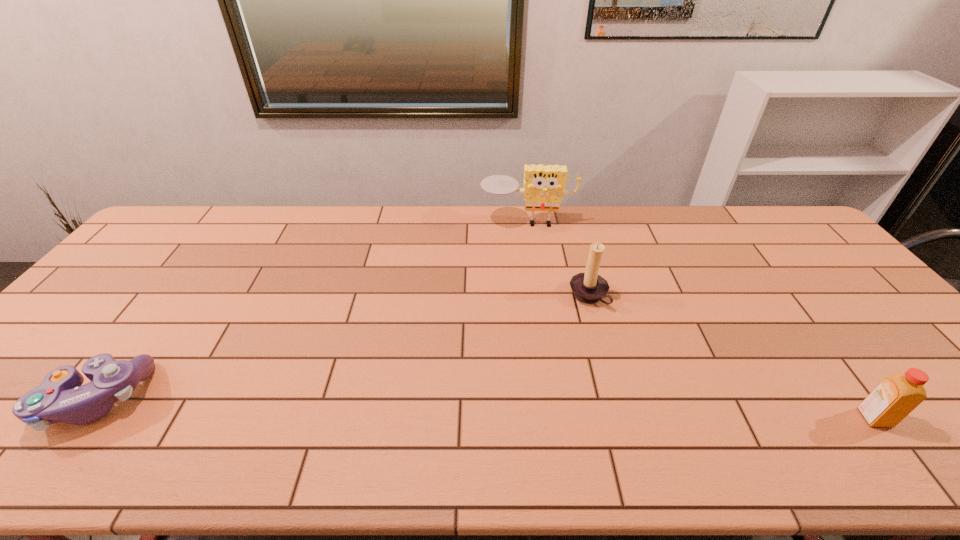
Find the location of a particular element. vacant region between the sponge and the candle holder is located at coordinates (558, 259).

Locate an element on the screen. The height and width of the screenshot is (540, 960). object identified as the third closest to the control is located at coordinates (896, 396).

Locate which object ranks second in proximity to the third tallest object. Please provide its 2D coordinates. Your answer should be formatted as a tuple, i.e. [(x, y)], where the tuple contains the x and y coordinates of a point satisfying the conditions above.

[(543, 190)]

Image resolution: width=960 pixels, height=540 pixels. I want to click on vacant position in the image that satisfies the following two spatial constraints: 1. on the front side of the candle holder; 2. on the left side of the farthest object, so click(x=538, y=296).

This screenshot has height=540, width=960. In order to click on free spot that satisfies the following two spatial constraints: 1. on the front side of the orange juice; 2. on the front and back of the candle holder in this screenshot , I will do `click(621, 418)`.